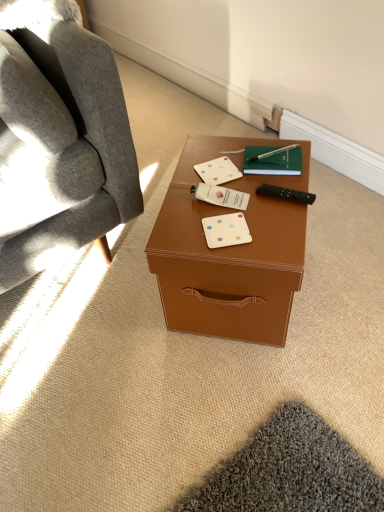
The width and height of the screenshot is (384, 512). What are the coordinates of `free space to the left of white matte business card at center, the 1th business card viewed from the front` in the screenshot? It's located at (178, 232).